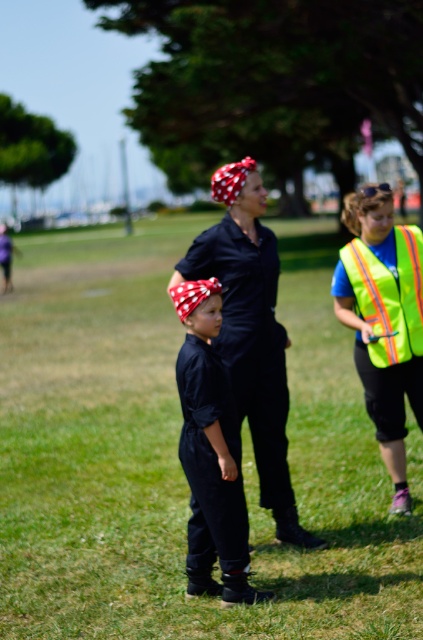
Question: Which object appears closest to the camera in this image?

Choices:
 (A) neon yellow reflective vest at right
 (B) green grass at center

Answer: (B)

Question: Observing the image, what is the correct spatial positioning of matte black jumpsuit at center in reference to neon yellow reflective safety vest at right?

Choices:
 (A) below
 (B) above

Answer: (A)

Question: Is matte black shirt at center in front of neon yellow reflective vest at right?

Choices:
 (A) no
 (B) yes

Answer: (B)

Question: Observing the image, what is the correct spatial positioning of matte black shirt at center in reference to neon yellow reflective safety vest at right?

Choices:
 (A) left
 (B) right

Answer: (A)

Question: Based on their relative distances, which object is nearer to the green grass at center?

Choices:
 (A) neon yellow reflective safety vest at right
 (B) matte black shirt at center
 (C) matte black jumpsuit at center
 (D) neon yellow reflective vest at right

Answer: (C)

Question: Estimate the real-world distances between objects in this image. Which object is closer to the matte black shirt at center?

Choices:
 (A) neon yellow reflective safety vest at right
 (B) green grass at center
 (C) neon yellow reflective vest at right
 (D) matte black jumpsuit at center

Answer: (D)